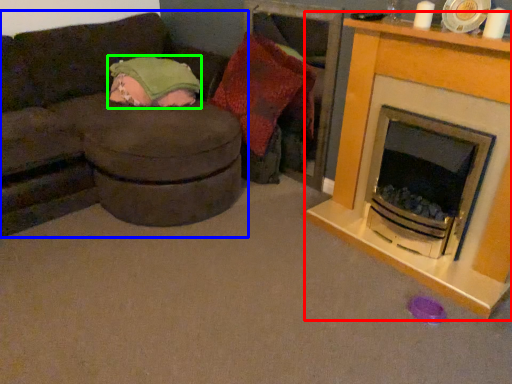
Question: Which object is the closest to the fireplace (highlighted by a red box)? Choose among these: studio couch (highlighted by a blue box) or blanket (highlighted by a green box).

Choices:
 (A) studio couch
 (B) blanket

Answer: (A)